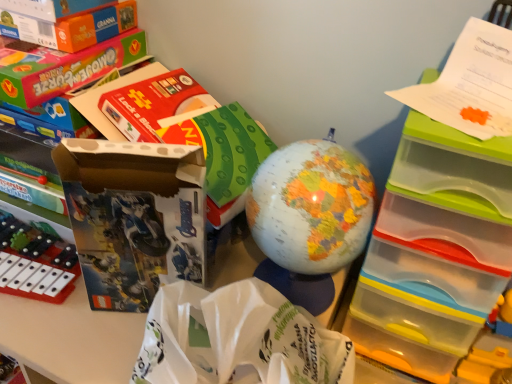
Where is `free point above clear plastic drawers at upper right (from a real-world perspective)`? This screenshot has width=512, height=384. free point above clear plastic drawers at upper right (from a real-world perspective) is located at coordinates (455, 102).